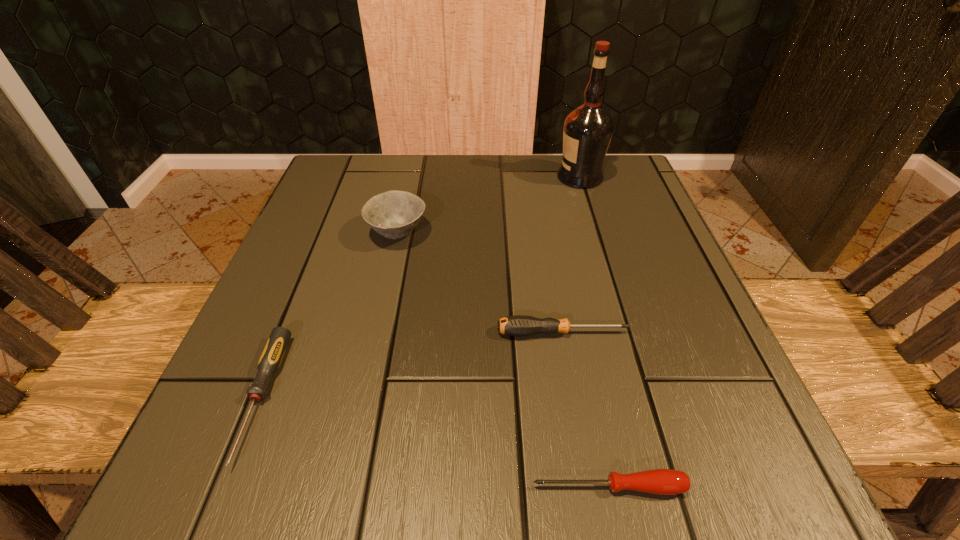
Select which object is the second closest to the tallest object. Please provide its 2D coordinates. Your answer should be formatted as a tuple, i.e. [(x, y)], where the tuple contains the x and y coordinates of a point satisfying the conditions above.

[(519, 325)]

Find the location of `the third closest object relative to the bowl`. the third closest object relative to the bowl is located at coordinates (588, 129).

At what (x,y) coordinates should I click in order to perform the action: click on screwdriver that stands as the closest to the nearest object. Please return your answer as a coordinate pair (x, y). This screenshot has width=960, height=540. Looking at the image, I should click on (519, 325).

Select which screwdriver is the second closest to the leftmost screwdriver. Please provide its 2D coordinates. Your answer should be formatted as a tuple, i.e. [(x, y)], where the tuple contains the x and y coordinates of a point satisfying the conditions above.

[(657, 481)]

In order to click on vacant space that satisfies the following two spatial constraints: 1. on the surface of the tallest object; 2. on the front side of the fourth object from right to left in this screenshot , I will do `click(597, 233)`.